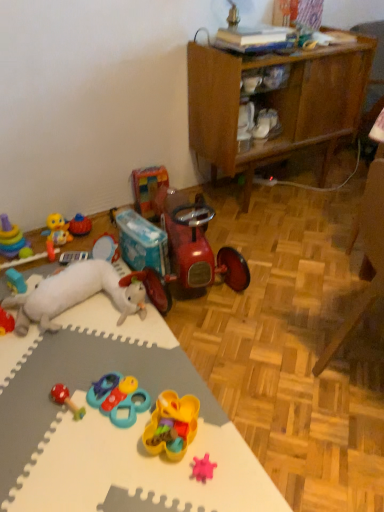
Where is `vacant space that's between shiny red tricycle at center, which appears as the 10th toy when viewed from the left, and white foam mat at lower left`? This screenshot has height=512, width=384. vacant space that's between shiny red tricycle at center, which appears as the 10th toy when viewed from the left, and white foam mat at lower left is located at coordinates (231, 365).